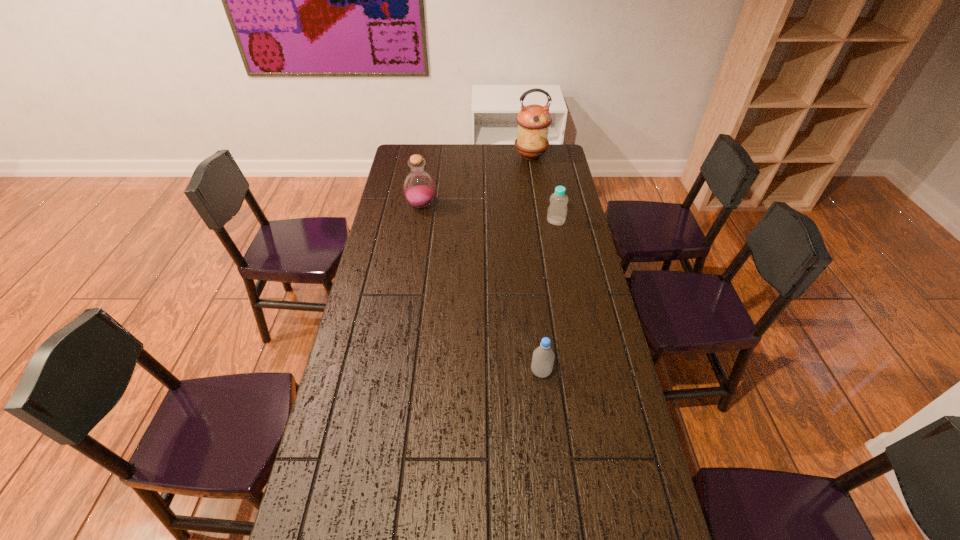
You are a GUI agent. You are given a task and a screenshot of the screen. Output one action in this format:
    pyautogui.click(x=<x>, y=<y>)
    Task: Click on the free location located 0.100m on the back of the third farthest object
    The height and width of the screenshot is (540, 960).
    Given the screenshot: What is the action you would take?
    pyautogui.click(x=552, y=203)

This screenshot has width=960, height=540. Find the location of `vacant area situated on the front of the nearest object`. vacant area situated on the front of the nearest object is located at coordinates (553, 477).

The height and width of the screenshot is (540, 960). What are the coordinates of `object at the far edge` in the screenshot? It's located at (533, 121).

Locate an element on the screen. The width and height of the screenshot is (960, 540). object at the left edge is located at coordinates (419, 189).

Where is `oil lamp positioned at the right edge`? The width and height of the screenshot is (960, 540). oil lamp positioned at the right edge is located at coordinates (533, 121).

Identify the location of bottle at the right edge. (557, 211).

Identify the location of object located at the far right corner. The width and height of the screenshot is (960, 540). (533, 121).

The height and width of the screenshot is (540, 960). In the image, there is a desktop. In order to click on free region at the left edge in this screenshot , I will do (377, 359).

In the image, there is a desktop. Identify the location of vacant space at the right edge. This screenshot has height=540, width=960. (572, 365).

This screenshot has height=540, width=960. Identify the location of free space between the oil lamp and the second bottle from right to left. pyautogui.click(x=536, y=264).